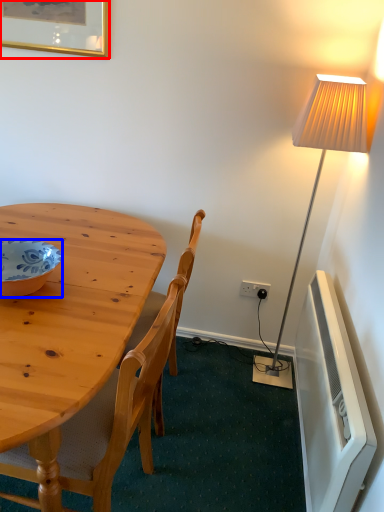
Question: Which point is further to the camera, picture frame (highlighted by a red box) or bowl (highlighted by a blue box)?

Choices:
 (A) picture frame
 (B) bowl

Answer: (A)